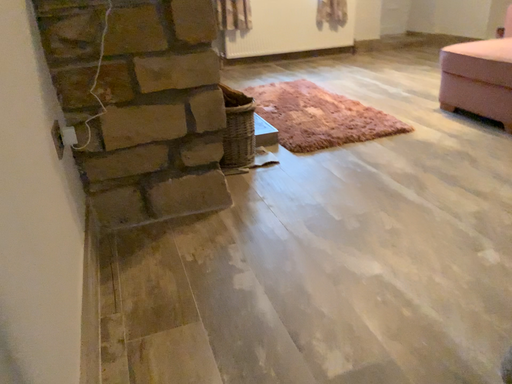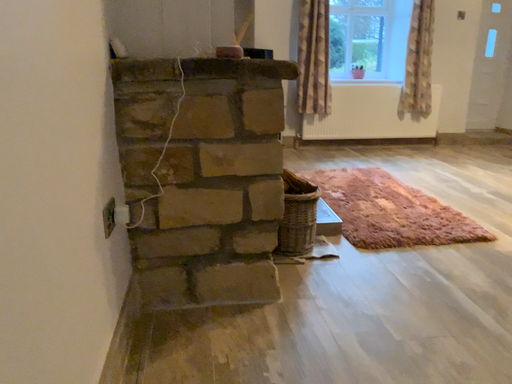
Question: Which way did the camera rotate in the video?

Choices:
 (A) rotated left
 (B) rotated right

Answer: (A)